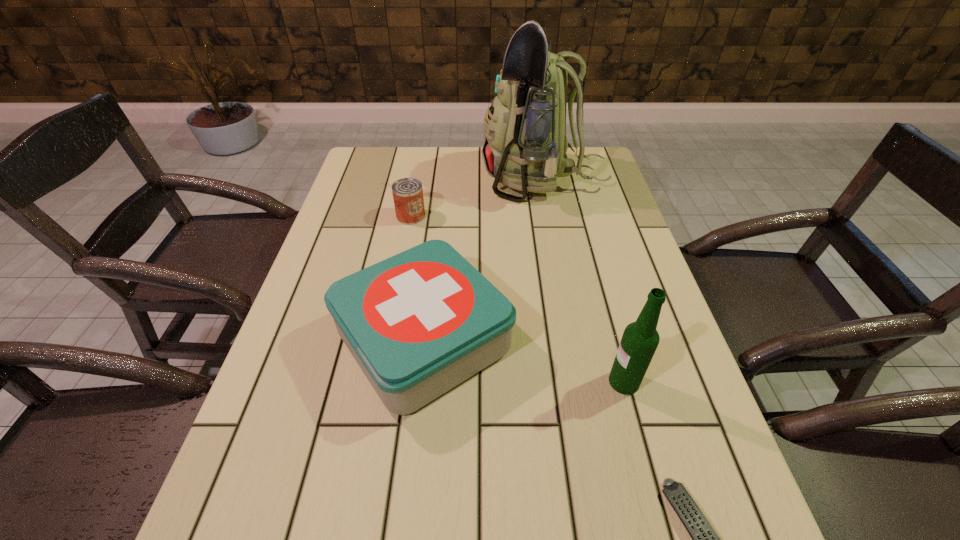
Find the location of a particular element. This screenshot has height=540, width=960. vacant space situated 0.310m on the back of the first-aid kit is located at coordinates (439, 205).

Find the location of a particular element. The image size is (960, 540). free space located 0.380m on the right of the second shortest object is located at coordinates (558, 216).

At what (x,y) coordinates should I click in order to perform the action: click on object present at the far edge. Please return your answer as a coordinate pair (x, y). Looking at the image, I should click on (525, 142).

Identify the location of object positioned at the left edge. (419, 323).

The height and width of the screenshot is (540, 960). I want to click on backpack that is at the right edge, so click(525, 142).

Find the location of `beer bottle at the right edge`. beer bottle at the right edge is located at coordinates (640, 339).

This screenshot has width=960, height=540. Identify the location of object that is positioned at the far right corner. (525, 142).

You are a GUI agent. You are given a task and a screenshot of the screen. Output one action in this format:
    pyautogui.click(x=<x>, y=<y>)
    Task: Click on the vacant space at the far edge of the desktop
    Image resolution: width=960 pixels, height=540 pixels.
    Given the screenshot: What is the action you would take?
    pyautogui.click(x=445, y=173)

In order to click on vacant position at the left edge of the desktop in this screenshot , I will do `click(311, 307)`.

I want to click on vacant area at the right edge of the desktop, so click(637, 271).